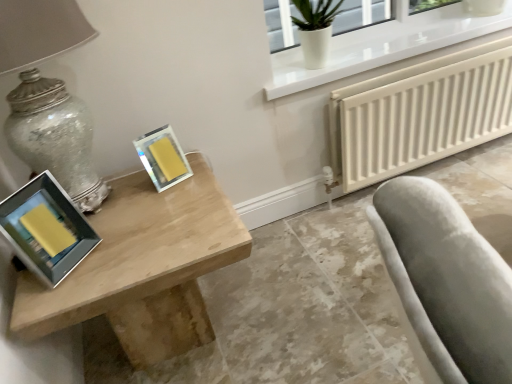
What do you see at coordinates (46, 229) in the screenshot? This screenshot has width=512, height=384. I see `matte yellow picture frame at left, which ranks as the 1th picture frame in front-to-back order` at bounding box center [46, 229].

I want to click on matte yellow picture frame at left, marked as the 2th picture frame in a right-to-left arrangement, so click(x=46, y=229).

What do you see at coordinates (144, 268) in the screenshot? I see `light wood table at left` at bounding box center [144, 268].

What do you see at coordinates (163, 158) in the screenshot? I see `yellow matte picture frame at upper center, which is counted as the 1th picture frame, starting from the right` at bounding box center [163, 158].

Where is `white glossy glass vase at upper right`? white glossy glass vase at upper right is located at coordinates coord(315,29).

What is the approximate height of white textured radiator at lower right?

white textured radiator at lower right is 18.68 inches tall.

In order to face white textured radiator at lower right, should I rotate leftwards or rightwards?

Turn right by 23.310 degrees to look at white textured radiator at lower right.

Locate an element on the screen. Image resolution: width=512 pixels, height=384 pixels. matte yellow picture frame at left, marked as the 2th picture frame in a right-to-left arrangement is located at coordinates (46, 229).

Is light wood table at left facing away from white textured radiator at lower right?

No, light wood table at left's orientation is not away from white textured radiator at lower right.

Is light wood table at left behind white textured radiator at lower right?

No.

How different are the orientations of light wood table at left and white textured radiator at lower right in degrees?

light wood table at left and white textured radiator at lower right are facing 0.842 degrees away from each other.

From a real-world perspective, which object rests below the other?

light wood table at left is physically lower.

How different are the orientations of matte glass table lamp at left and white glossy glass vase at upper right in degrees?

The facing directions of matte glass table lamp at left and white glossy glass vase at upper right are 0.000629 degrees apart.

Is matte glass table lamp at left next to white glossy glass vase at upper right?

No.

Between matte glass table lamp at left and white glossy glass vase at upper right, which one is positioned behind?

white glossy glass vase at upper right is behind.

Could you tell me if matte glass table lamp at left is facing light wood table at left?

No.

Find the location of a particular element. This screenshot has width=512, height=384. table lamp in front of the light wood table at left is located at coordinates (49, 96).

Is point (38, 26) closer to viewer compared to point (118, 285)?

That is True.

In terms of height, does matte glass table lamp at left look taller or shorter compared to light wood table at left?

Considering their sizes, matte glass table lamp at left has more height than light wood table at left.

Where is `table lying on the left of white textured radiator at lower right`? Image resolution: width=512 pixels, height=384 pixels. table lying on the left of white textured radiator at lower right is located at coordinates (144, 268).

Is white textured radiator at lower right in contact with light wood table at left?

They are not placed beside each other.

Is white glossy glass vase at upper right taller or shorter than matte yellow picture frame at left, positioned as the 2th picture frame in back-to-front order?

white glossy glass vase at upper right is taller than matte yellow picture frame at left, positioned as the 2th picture frame in back-to-front order.

From the image's perspective, between white glossy glass vase at upper right and matte yellow picture frame at left, positioned as the 2th picture frame in back-to-front order, who is located below?

matte yellow picture frame at left, positioned as the 2th picture frame in back-to-front order.

From a real-world perspective, is white glossy glass vase at upper right physically located above or below matte yellow picture frame at left, marked as the 2th picture frame in a right-to-left arrangement?

In terms of real-world spatial position, white glossy glass vase at upper right is above matte yellow picture frame at left, marked as the 2th picture frame in a right-to-left arrangement.

In the scene shown: Which is correct: white glossy glass vase at upper right is inside matte yellow picture frame at left, marked as the 2th picture frame in a right-to-left arrangement, or outside of it?

white glossy glass vase at upper right is not inside matte yellow picture frame at left, marked as the 2th picture frame in a right-to-left arrangement, it's outside.

Locate an element on the screen. glass vase positioned vertically above the white textured radiator at lower right (from a real-world perspective) is located at coordinates (315, 29).

Considering the positions of objects white glossy glass vase at upper right and white textured radiator at lower right in the image provided, who is in front, white glossy glass vase at upper right or white textured radiator at lower right?

white glossy glass vase at upper right is closer to the camera.

Are white glossy glass vase at upper right and white textured radiator at lower right making contact?

No, white glossy glass vase at upper right is not beside white textured radiator at lower right.

Visually, is white glossy glass vase at upper right positioned to the left or to the right of white textured radiator at lower right?

white glossy glass vase at upper right is to the left of white textured radiator at lower right.

Is matte glass table lamp at left facing towards white textured radiator at lower right?

No, matte glass table lamp at left is not oriented towards white textured radiator at lower right.

Is matte glass table lamp at left bigger or smaller than white textured radiator at lower right?

matte glass table lamp at left is bigger than white textured radiator at lower right.

Is matte glass table lamp at left to the left of white textured radiator at lower right from the viewer's perspective?

Yes, matte glass table lamp at left is to the left of white textured radiator at lower right.

Can you confirm if matte glass table lamp at left is thinner than white textured radiator at lower right?

No.

The width and height of the screenshot is (512, 384). I want to click on radiator above the light wood table at left (from the image's perspective), so click(x=420, y=114).

Locate an element on the screen. This screenshot has height=384, width=512. table lamp above the white glossy glass vase at upper right (from a real-world perspective) is located at coordinates (49, 96).

Considering their positions, is matte glass table lamp at left positioned further to white textured radiator at lower right than yellow matte picture frame at upper center, which is the first picture frame from back to front?

matte glass table lamp at left lies further to white textured radiator at lower right than the other object.

Considering their positions, is matte yellow picture frame at left, which ranks as the 1th picture frame in front-to-back order, positioned closer to matte glass table lamp at left than yellow matte picture frame at upper center, which is counted as the 1th picture frame, starting from the right?

Among the two, matte yellow picture frame at left, which ranks as the 1th picture frame in front-to-back order, is located nearer to matte glass table lamp at left.

Based on their spatial positions, is white glossy glass vase at upper right or light wood table at left closer to matte glass table lamp at left?

Based on the image, light wood table at left appears to be nearer to matte glass table lamp at left.

Considering their positions, is white glossy glass vase at upper right positioned closer to light wood table at left than white textured radiator at lower right?

white textured radiator at lower right is positioned closer to the anchor light wood table at left.

Estimate the real-world distances between objects in this image. Which object is closer to matte yellow picture frame at left, which ranks as the 1th picture frame in front-to-back order, light wood table at left or matte glass table lamp at left?

matte glass table lamp at left is closer to matte yellow picture frame at left, which ranks as the 1th picture frame in front-to-back order.

Estimate the real-world distances between objects in this image. Which object is closer to light wood table at left, white textured radiator at lower right or matte glass table lamp at left?

matte glass table lamp at left lies closer to light wood table at left than the other object.

Which object lies further to the anchor point matte glass table lamp at left, white glossy glass vase at upper right or matte yellow picture frame at left, which ranks as the 1th picture frame in front-to-back order?

white glossy glass vase at upper right lies further to matte glass table lamp at left than the other object.

Consider the image. Looking at the image, which one is located closer to white glossy glass vase at upper right, yellow matte picture frame at upper center, which is the first picture frame from back to front, or light wood table at left?

The object closer to white glossy glass vase at upper right is yellow matte picture frame at upper center, which is the first picture frame from back to front.

This screenshot has width=512, height=384. I want to click on table lamp between white glossy glass vase at upper right and light wood table at left vertically, so click(x=49, y=96).

Where is `glass vase between light wood table at left and white textured radiator at lower right`? This screenshot has width=512, height=384. glass vase between light wood table at left and white textured radiator at lower right is located at coordinates (315, 29).

This screenshot has height=384, width=512. I want to click on table located between matte yellow picture frame at left, marked as the 2th picture frame in a right-to-left arrangement, and yellow matte picture frame at upper center, which is the first picture frame from back to front, in the depth direction, so click(x=144, y=268).

Locate an element on the screen. table located between matte glass table lamp at left and white textured radiator at lower right in the left-right direction is located at coordinates (144, 268).